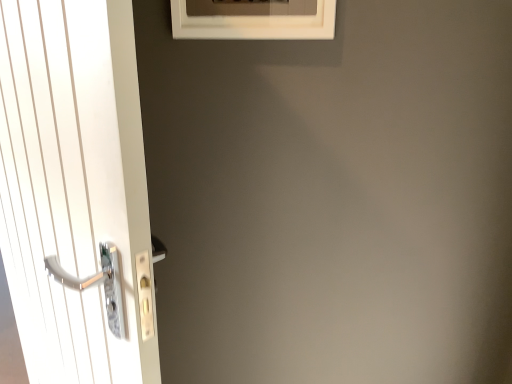
Question: Can we say white matte frame at upper center lies outside white glossy door handle at left?

Choices:
 (A) yes
 (B) no

Answer: (A)

Question: Does white matte frame at upper center appear on the left side of white glossy door handle at left?

Choices:
 (A) no
 (B) yes

Answer: (A)

Question: Is white matte frame at upper center at the right side of white glossy door handle at left?

Choices:
 (A) no
 (B) yes

Answer: (B)

Question: Are white matte frame at upper center and white glossy door handle at left located far from each other?

Choices:
 (A) no
 (B) yes

Answer: (A)

Question: From a real-world perspective, does white matte frame at upper center sit lower than white glossy door handle at left?

Choices:
 (A) no
 (B) yes

Answer: (A)

Question: Does white matte frame at upper center turn towards white glossy door handle at left?

Choices:
 (A) no
 (B) yes

Answer: (A)

Question: Is white glossy door handle at left taller than white matte frame at upper center?

Choices:
 (A) yes
 (B) no

Answer: (A)

Question: Does white glossy door handle at left come behind white matte frame at upper center?

Choices:
 (A) no
 (B) yes

Answer: (A)

Question: Could you tell me if white glossy door handle at left is facing white matte frame at upper center?

Choices:
 (A) no
 (B) yes

Answer: (A)

Question: From a real-world perspective, does white glossy door handle at left sit lower than white matte frame at upper center?

Choices:
 (A) no
 (B) yes

Answer: (B)

Question: Considering the relative sizes of white glossy door handle at left and white matte frame at upper center in the image provided, is white glossy door handle at left bigger than white matte frame at upper center?

Choices:
 (A) no
 (B) yes

Answer: (B)

Question: From the image's perspective, would you say white glossy door handle at left is positioned over white matte frame at upper center?

Choices:
 (A) no
 (B) yes

Answer: (A)

Question: Visually, is white matte frame at upper center positioned to the left or to the right of white glossy door handle at left?

Choices:
 (A) right
 (B) left

Answer: (A)